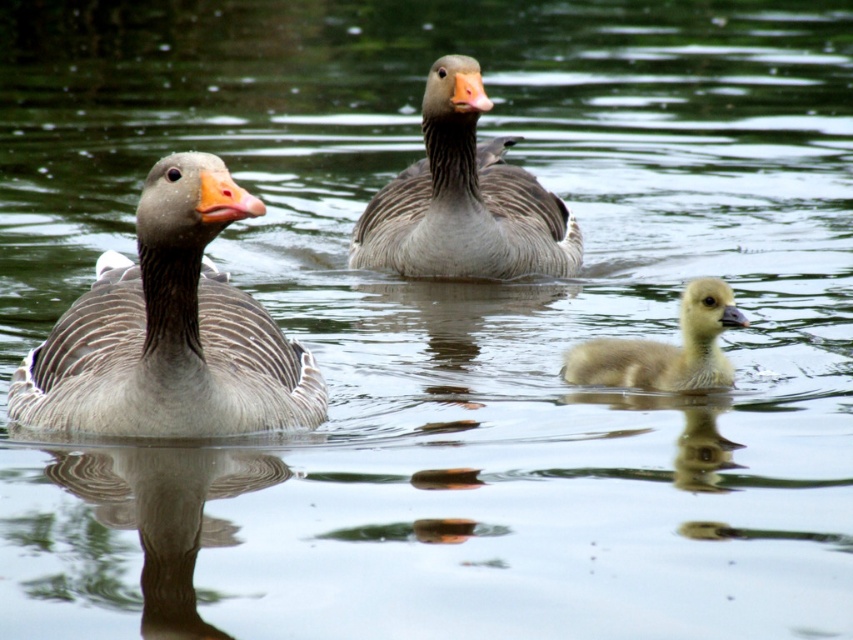
In the scene shown: Between gray matte duck at center and yellow downy duckling at center, which one has more height?

With more height is gray matte duck at center.

Between gray matte duck at center and yellow downy duckling at center, which one is positioned lower?

yellow downy duckling at center is lower down.

Is point (538, 259) closer to camera compared to point (741, 317)?

No, it is behind (741, 317).

The height and width of the screenshot is (640, 853). Identify the location of gray matte duck at center. (463, 198).

Does gray matte duck at left have a lesser height compared to gray matte duck at center?

Yes, gray matte duck at left is shorter than gray matte duck at center.

Is gray matte duck at left taller than gray matte duck at center?

No.

At what (x,y) coordinates should I click in order to perform the action: click on gray matte duck at left. Please return your answer as a coordinate pair (x, y). Looking at the image, I should click on (170, 332).

Is point (117, 296) positioned in front of point (676, 355)?

Yes, point (117, 296) is closer to viewer.

Does gray matte duck at left have a greater height compared to yellow downy duckling at center?

Correct, gray matte duck at left is much taller as yellow downy duckling at center.

Looking at this image, who is more distant from viewer, (99, 310) or (729, 381)?

The point (729, 381) is more distant.

At what (x,y) coordinates should I click in order to perform the action: click on gray matte duck at left. Please return your answer as a coordinate pair (x, y). The image size is (853, 640). Looking at the image, I should click on (170, 332).